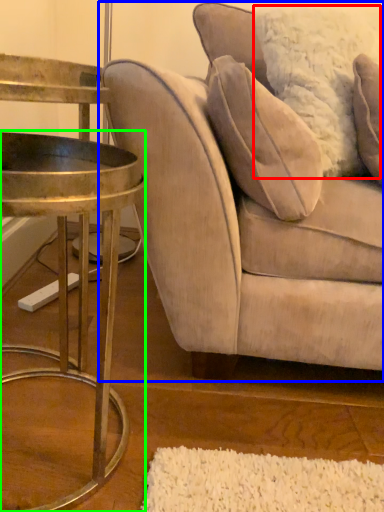
Question: Considering the real-world distances, which object is farthest from pillow (highlighted by a red box)? studio couch (highlighted by a blue box) or table (highlighted by a green box)?

Choices:
 (A) studio couch
 (B) table

Answer: (B)